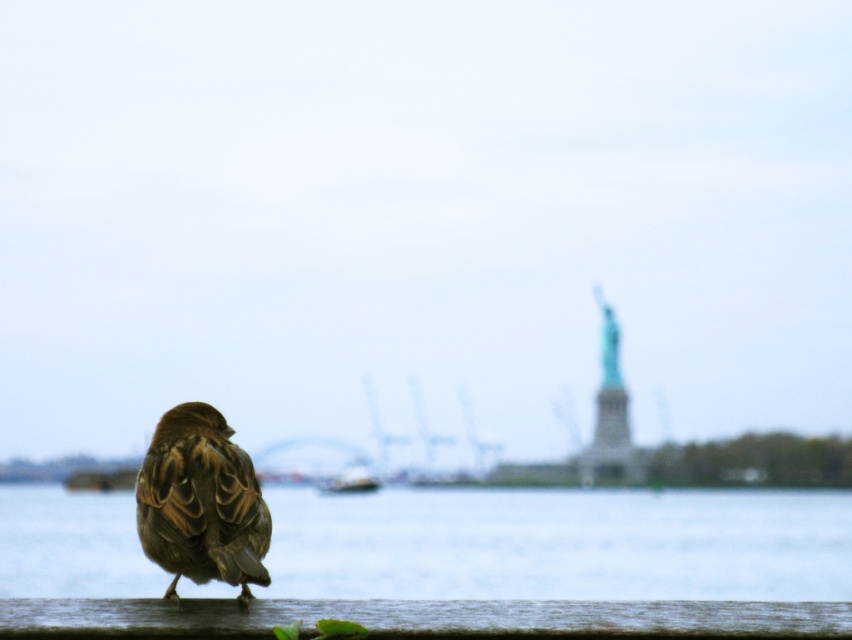
You are a photographer aiming to capture the Statue of Liberty in the background. To do this, you need to adjust your camera to focus on distant objects. Which object between the brown wooden rail at lower center and the smooth water at lower center should you focus on to ensure the Statue of Liberty is sharp?

You should focus on the brown wooden rail at lower center because it is further away than the smooth water at lower center, aligning better with the distance to the Statue of Liberty.

You are a birdwatcher trying to estimate distances in the scene. You see the brown feathered sparrow at lower left and the white plastic boat at center. Which object is closer to you?

The brown feathered sparrow at lower left is closer to you since it is only 89.01 meters away from the white plastic boat at center, and given the sparrow is in the foreground while the boat is in the midground.